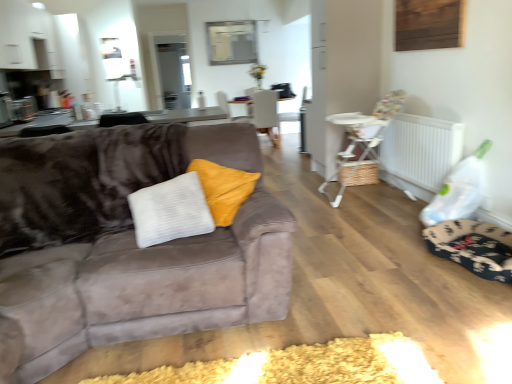
Question: Is point (347, 180) positioned closer to the camera than point (303, 89)?

Choices:
 (A) farther
 (B) closer

Answer: (B)

Question: Is white plastic highchair at right, placed as the 1th chair when sorted from right to left, wider or thinner than white fabric armchair at center?

Choices:
 (A) thin
 (B) wide

Answer: (B)

Question: Considering the real-world distances, which object is farthest from the white plastic radiator at right?

Choices:
 (A) suede couch at left
 (B) white fabric armchair at center
 (C) matte gray chair at center, acting as the 2th chair starting from the right
 (D) floral fabric dog bed at lower right
 (E) white plastic highchair at right, placed as the 2th chair when sorted from back to front

Answer: (B)

Question: Which object is positioned farthest from the matte gray chair at center, which is counted as the first chair, starting from the back?

Choices:
 (A) white plastic highchair at right, placed as the 1th chair when sorted from right to left
 (B) white plastic radiator at right
 (C) white fabric armchair at center
 (D) floral fabric dog bed at lower right
 (E) white woven basket at center

Answer: (D)